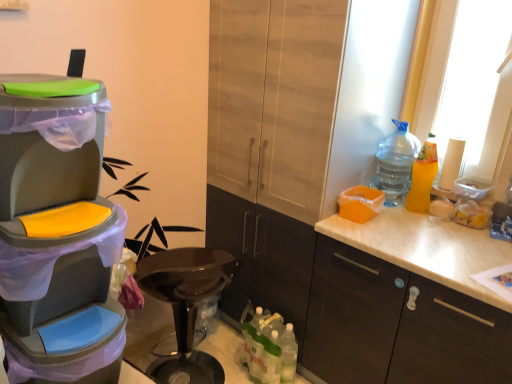
Locate an element on the screen. This screenshot has width=512, height=384. free spot in front of clear plastic bottle at upper right, acting as the first bottle starting from the top is located at coordinates (404, 216).